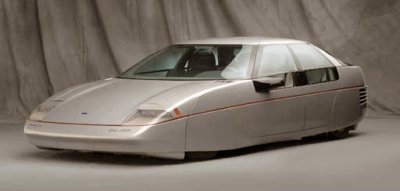
Locate an element on the screen. hood is located at coordinates (98, 98).